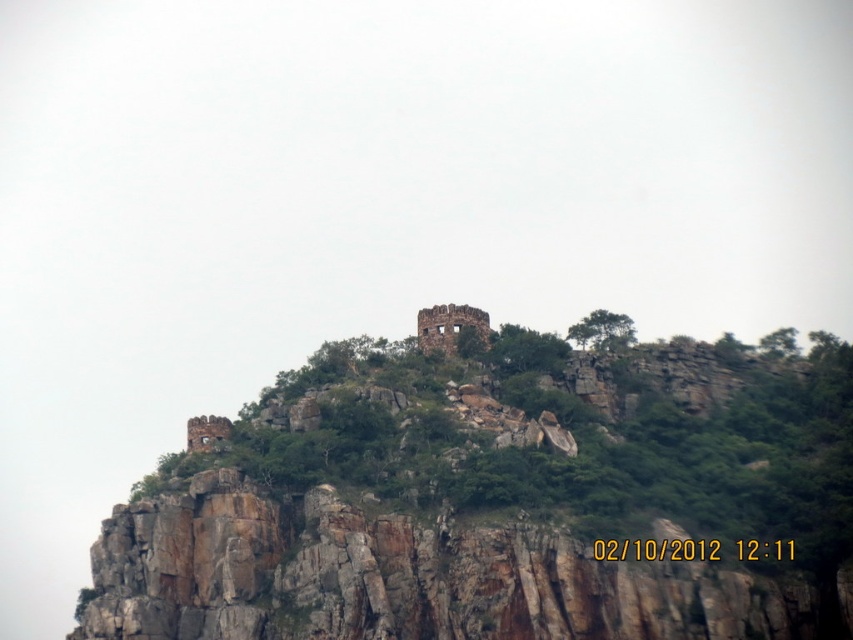
You are standing at the base of the hill looking up at the rusty stone ruins at upper center and the rustic stone castle at upper center. Which structure appears nearer to you?

The rusty stone ruins at upper center appears nearer to you because it is closer to the viewer than the rustic stone castle at upper center.

You are a hiker who has reached the top of the hill. You see the rusty stone ruins at upper center and the rustic stone castle at upper center. Which one is located higher up on the hill?

The rustic stone castle at upper center is located higher up on the hill because the rusty stone ruins at upper center is positioned under it.

You are standing at the base of the rocky hilltop and looking up at the ancient watchtower. There are two points marked on the hillside. Which of the two points, point (650, 621) or point (422, 339), is closer to you?

Point (650, 621) is closer to the viewer than point (422, 339).